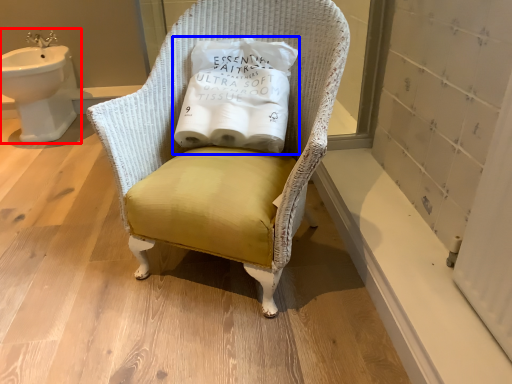
Question: Which object appears closest to the camera in this image, sink (highlighted by a red box) or toilet paper (highlighted by a blue box)?

Choices:
 (A) sink
 (B) toilet paper

Answer: (B)